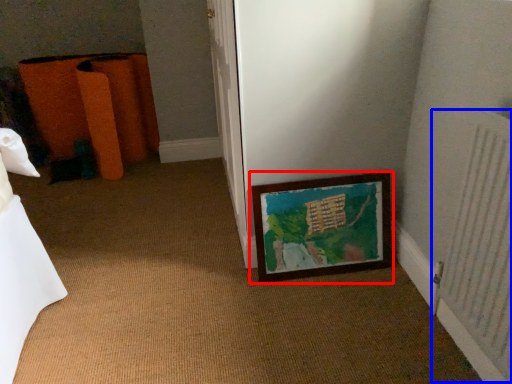
Question: Which object is further to the camera taking this photo, picture frame (highlighted by a red box) or radiator (highlighted by a blue box)?

Choices:
 (A) picture frame
 (B) radiator

Answer: (A)